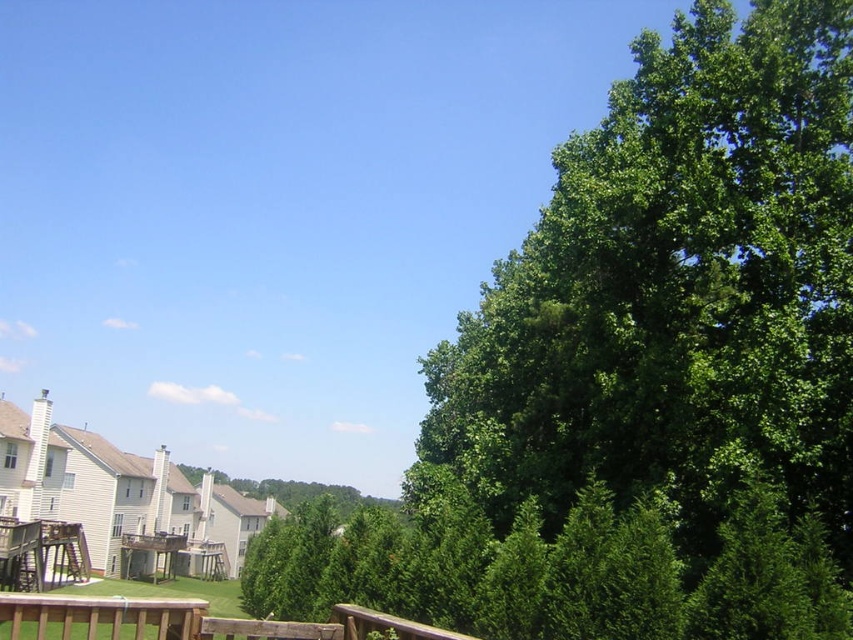
You are a photographer standing on the wooden deck railing in the foreground. You want to take a photo that includes both the green leafy tree at upper right and the brown wooden porch at lower left. Which object will appear larger in your photo?

The green leafy tree at upper right will appear larger in the photo because it is bigger than the brown wooden porch at lower left according to the description.

You are standing on the wooden deck railing and want to look at two points in the scene. The first point is at coordinates point (740,24) and the second is at point (247,627). Which point is closer to you?

Point (247,627) is closer to you because it is in front of point (740,24), which is behind it.

You are standing on a balcony and looking out at the suburban scene. There is a point marked at coordinates (641,374). What object is located at that point?

The point at coordinates (641,374) indicates a green leafy tree at upper right.